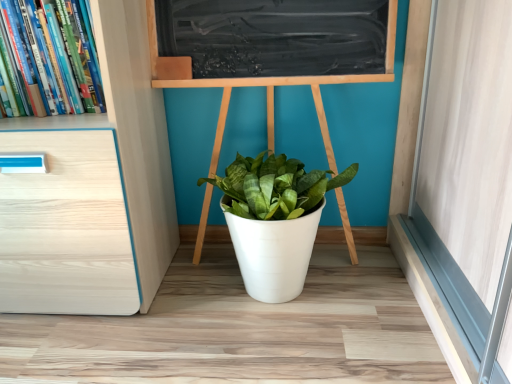
At what (x,y) coordinates should I click in order to perform the action: click on hardcover books at left. Please return your answer as a coordinate pair (x, y). The width and height of the screenshot is (512, 384). Looking at the image, I should click on (53, 54).

What do you see at coordinates (53, 54) in the screenshot? Image resolution: width=512 pixels, height=384 pixels. I see `hardcover books at left` at bounding box center [53, 54].

Locate an element on the screen. white matte pot at center is located at coordinates (274, 220).

Describe the element at coordinates (274, 220) in the screenshot. I see `white matte pot at center` at that location.

You are a GUI agent. You are given a task and a screenshot of the screen. Output one action in this format:
    pyautogui.click(x=<x>, y=<y>)
    Task: Click on the hardcover books at left
    The width and height of the screenshot is (512, 384).
    Given the screenshot: What is the action you would take?
    pyautogui.click(x=53, y=54)

Which object is positioned more to the left, white matte pot at center or hardcover books at left?

Positioned to the left is hardcover books at left.

Considering the relative positions of white matte pot at center and hardcover books at left in the image provided, is white matte pot at center behind hardcover books at left?

Yes, white matte pot at center is further from the camera.

Considering the points (274, 231) and (83, 54), which point is in front, point (274, 231) or point (83, 54)?

Point (274, 231)

From the image's perspective, is white matte pot at center beneath hardcover books at left?

Yes.

From a real-world perspective, is white matte pot at center above or below hardcover books at left?

white matte pot at center is below hardcover books at left.

Is white matte pot at center wider than hardcover books at left?

Yes, white matte pot at center is wider than hardcover books at left.

Based on the photo, which of these two, white matte pot at center or hardcover books at left, stands shorter?

hardcover books at left.

Considering the sizes of white matte pot at center and hardcover books at left in the image, is white matte pot at center bigger or smaller than hardcover books at left?

Clearly, white matte pot at center is larger in size than hardcover books at left.

Could hardcover books at left be considered to be inside white matte pot at center?

Actually, hardcover books at left is outside white matte pot at center.

Is white matte pot at center placed right next to hardcover books at left?

No, white matte pot at center is not next to hardcover books at left.

Is white matte pot at center positioned with its back to hardcover books at left?

No, white matte pot at center's orientation is not away from hardcover books at left.

The image size is (512, 384). What are the coordinates of `book above the white matte pot at center (from a real-world perspective)` in the screenshot? It's located at (53, 54).

Between hardcover books at left and white matte pot at center, which one appears on the right side from the viewer's perspective?

Positioned to the right is white matte pot at center.

Relative to white matte pot at center, is hardcover books at left in front or behind?

In the image, hardcover books at left appears in front of white matte pot at center.

Considering the positions of point (4, 15) and point (298, 219), is point (4, 15) closer or farther from the camera than point (298, 219)?

Point (4, 15) appears to be closer to the viewer than point (298, 219).

From the image's perspective, is hardcover books at left above white matte pot at center?

Indeed, from the image's perspective, hardcover books at left is shown above white matte pot at center.

From a real-world perspective, is hardcover books at left positioned under white matte pot at center based on gravity?

Actually, hardcover books at left is physically above white matte pot at center in the real world.

Can you confirm if hardcover books at left is wider than white matte pot at center?

No.

In the scene shown: Between hardcover books at left and white matte pot at center, which one has less height?

hardcover books at left.

Is hardcover books at left bigger than white matte pot at center?

Actually, hardcover books at left might be smaller than white matte pot at center.

Is white matte pot at center a part of hardcover books at left?

No, white matte pot at center is not surrounded by hardcover books at left.

Is the surface of hardcover books at left in direct contact with white matte pot at center?

hardcover books at left and white matte pot at center are not in contact.

Is white matte pot at center at the back of hardcover books at left?

hardcover books at left is not turned away from white matte pot at center.

How distant is hardcover books at left from white matte pot at center?

20.55 inches.

Locate an element on the screen. book in front of the white matte pot at center is located at coordinates (53, 54).

Locate an element on the screen. Image resolution: width=512 pixels, height=384 pixels. houseplant located underneath the hardcover books at left (from a real-world perspective) is located at coordinates (274, 220).

In the image, there is a white matte pot at center. Identify the location of book above it (from the image's perspective). The height and width of the screenshot is (384, 512). (53, 54).